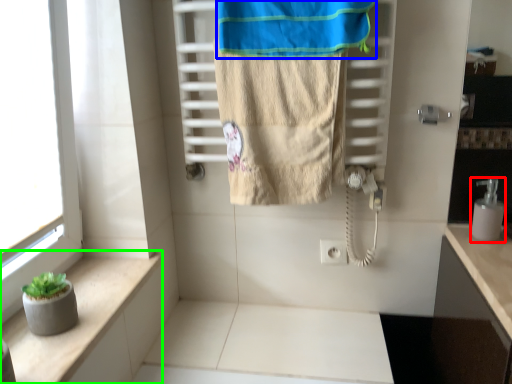
Question: Which is nearer to the soap dispenser (highlighted by a red box)? beach towel (highlighted by a blue box) or balustrade (highlighted by a green box).

Choices:
 (A) beach towel
 (B) balustrade

Answer: (A)